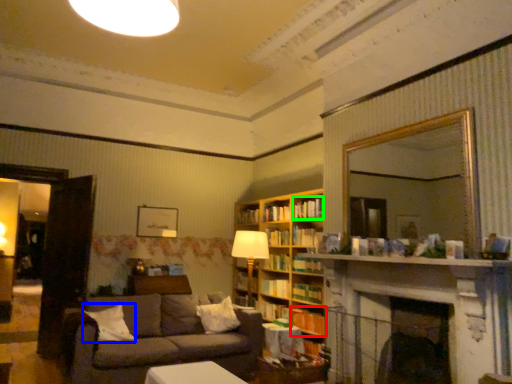
Question: Which object is the farthest from book (highlighted by a red box)? Choose among these: pillow (highlighted by a blue box) or book (highlighted by a green box).

Choices:
 (A) pillow
 (B) book

Answer: (A)